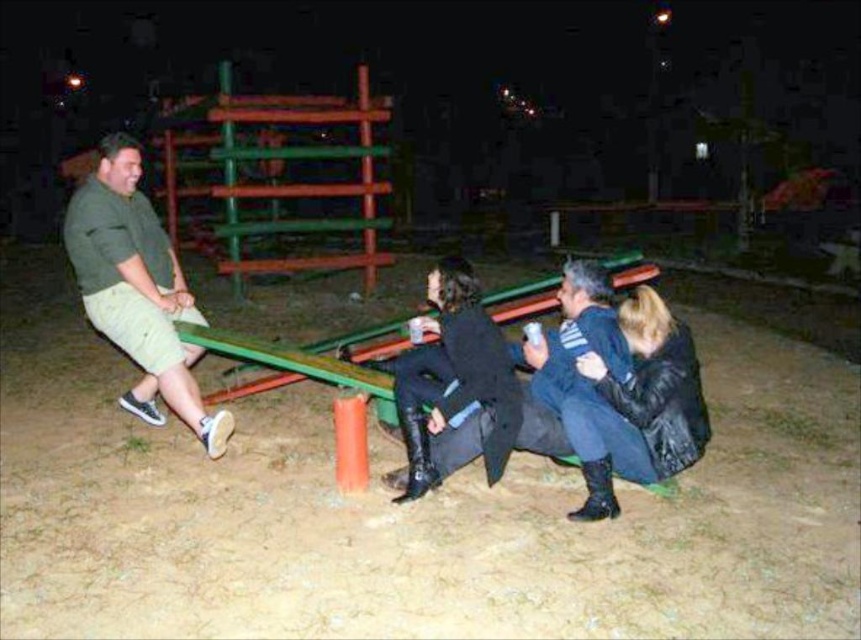
Which is below, green matte shorts at left or black leather boots at center?

black leather boots at center

Is green matte shorts at left smaller than black leather boots at center?

No, green matte shorts at left is not smaller than black leather boots at center.

Which is behind, point (93, 324) or point (400, 499)?

Point (93, 324)

Find the location of a particular element. This screenshot has width=861, height=640. green matte shorts at left is located at coordinates (137, 289).

Is point (643, 307) in front of point (438, 340)?

Yes, point (643, 307) is in front of point (438, 340).

Can you confirm if black leather jacket at lower right is bigger than black leather boots at center?

No.

Which is in front, point (608, 490) or point (491, 465)?

Point (608, 490) is in front.

Where is `black leather jacket at lower right`? This screenshot has width=861, height=640. black leather jacket at lower right is located at coordinates (637, 404).

Is point (116, 145) behind point (592, 461)?

Yes, it is.

Is green matte shorts at left bigger than black leather jacket at lower right?

Indeed, green matte shorts at left has a larger size compared to black leather jacket at lower right.

Identify the location of green matte shorts at left. This screenshot has width=861, height=640. (137, 289).